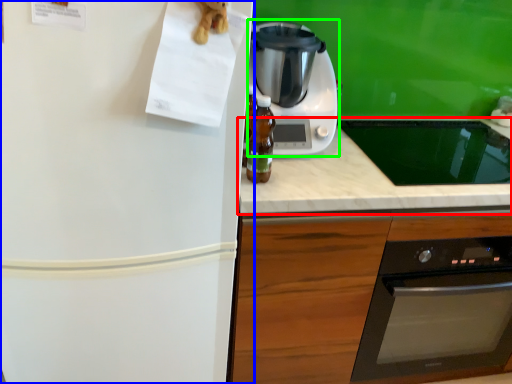
Question: Which is farther away from countertop (highlighted by a red box)? refrigerator (highlighted by a blue box) or kitchen appliance (highlighted by a green box)?

Choices:
 (A) refrigerator
 (B) kitchen appliance

Answer: (A)